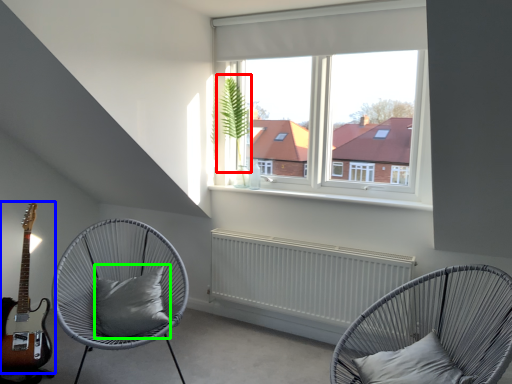
Question: Based on their relative distances, which object is farther from plant (highlighted by a red box)? Choose from guitar (highlighted by a blue box) and pillow (highlighted by a green box).

Choices:
 (A) guitar
 (B) pillow

Answer: (A)